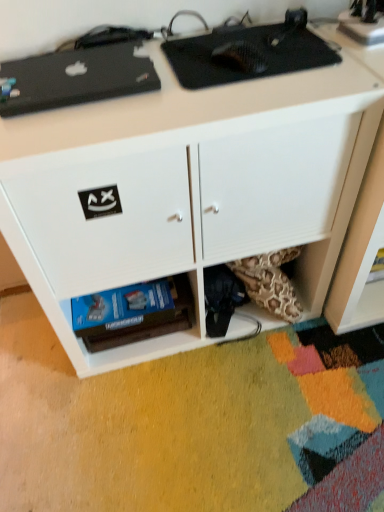
Where is `free point in front of white matte desk at upper center`? free point in front of white matte desk at upper center is located at coordinates (200, 426).